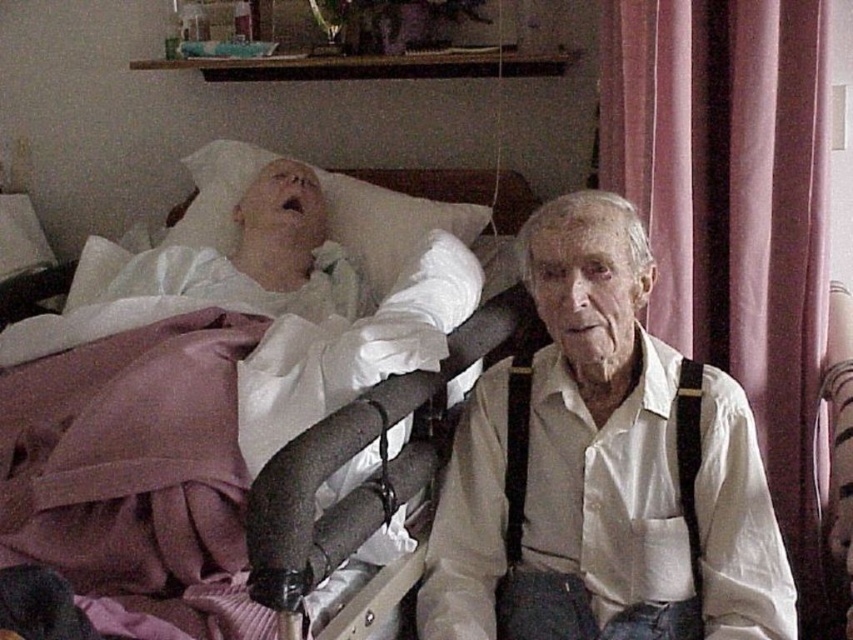
Who is positioned more to the right, pink fabric curtain at right or black fabric suspenders at right?

Positioned to the right is pink fabric curtain at right.

Does pink fabric curtain at right appear on the left side of black fabric suspenders at right?

Incorrect, pink fabric curtain at right is not on the left side of black fabric suspenders at right.

This screenshot has height=640, width=853. Identify the location of pink fabric curtain at right. (735, 220).

Describe the element at coordinates (602, 419) in the screenshot. This screenshot has width=853, height=640. I see `white cotton shirt at center` at that location.

Describe the element at coordinates (602, 419) in the screenshot. I see `white cotton shirt at center` at that location.

Where is `white cotton shirt at center`? white cotton shirt at center is located at coordinates (602, 419).

Does pink fabric curtain at right have a larger size compared to white soft pillow at upper left?

No.

Which of these two, pink fabric curtain at right or white soft pillow at upper left, stands shorter?

With less height is white soft pillow at upper left.

The width and height of the screenshot is (853, 640). I want to click on pink fabric curtain at right, so click(735, 220).